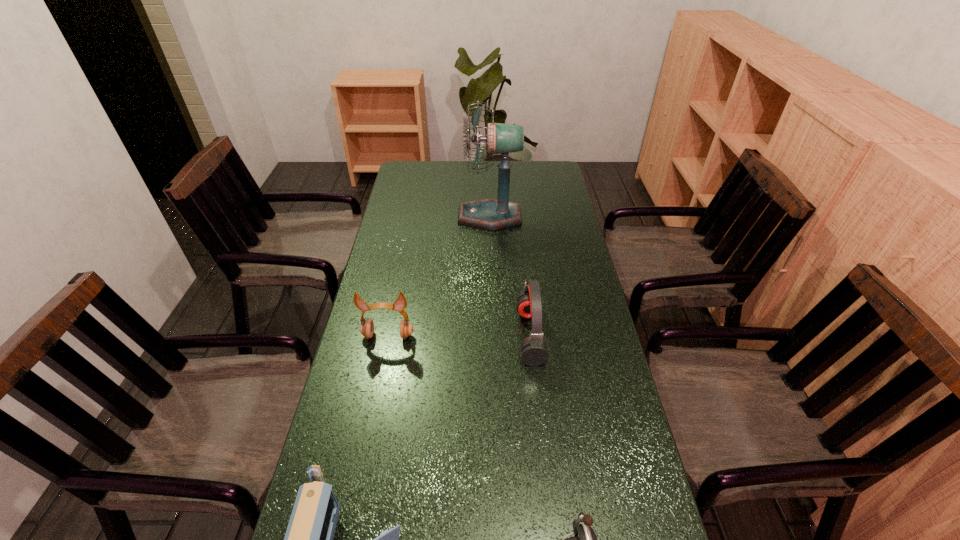
Locate an element on the screen. This screenshot has height=540, width=960. vacant space at the right edge is located at coordinates (529, 191).

Identify the location of vacant space at the far right corner of the desktop. Image resolution: width=960 pixels, height=540 pixels. (536, 167).

You are a GUI agent. You are given a task and a screenshot of the screen. Output one action in this format:
    pyautogui.click(x=<x>, y=<y>)
    Task: Click on the object that is the second closest to the nearest earphone
    The height and width of the screenshot is (540, 960).
    Given the screenshot: What is the action you would take?
    pyautogui.click(x=534, y=352)

The image size is (960, 540). What are the coordinates of `the fourth closest object to the nearest earphone` in the screenshot? It's located at (491, 214).

Find the location of `earphone that can be found as the second closest to the leftmost earphone`. earphone that can be found as the second closest to the leftmost earphone is located at coordinates (587, 539).

Identify the location of the second closest earphone to the fan. This screenshot has height=540, width=960. coord(367,326).